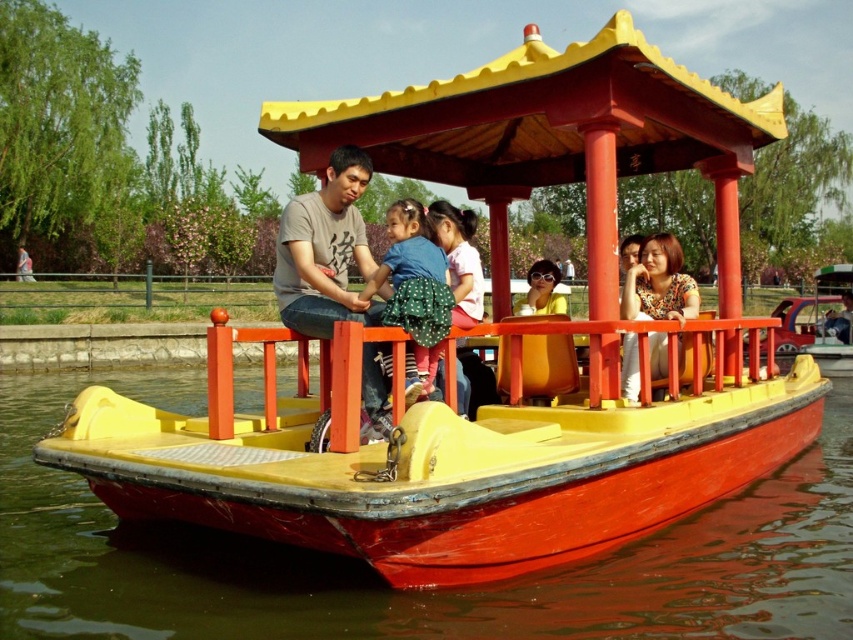
Question: Which point is farther to the camera?

Choices:
 (A) matte gray shirt at center
 (B) polka dot fabric dress at center
 (C) floral-patterned blouse at center

Answer: (C)

Question: Is red matte water at lower center closer to camera compared to polka dot fabric dress at center?

Choices:
 (A) no
 (B) yes

Answer: (B)

Question: In this image, where is red matte water at lower center located relative to floral-patterned blouse at center?

Choices:
 (A) below
 (B) above

Answer: (A)

Question: Is red matte water at lower center above polka dot fabric dress at center?

Choices:
 (A) no
 (B) yes

Answer: (A)

Question: Which of the following is the farthest from the observer?

Choices:
 (A) (403, 273)
 (B) (350, 216)
 (C) (646, 284)

Answer: (C)

Question: Which point is farther to the camera?

Choices:
 (A) (389, 236)
 (B) (624, 269)
 (C) (292, 225)

Answer: (A)